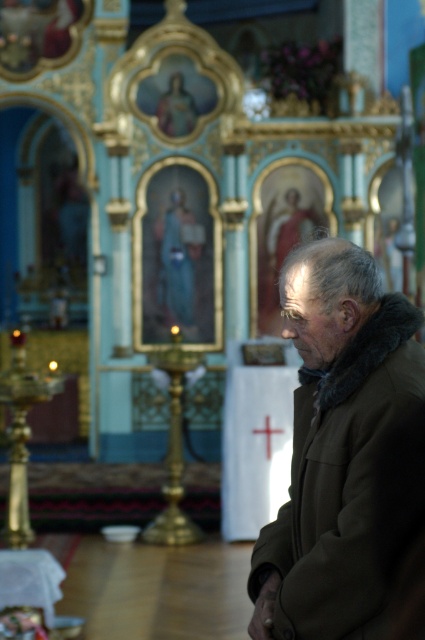
Does point (333, 326) come farther from viewer compared to point (269, 435)?

No, (333, 326) is in front of (269, 435).

Does brown fur-trimmed coat at center have a lesser width compared to white wooden cross at center?

Incorrect, brown fur-trimmed coat at center's width is not less than white wooden cross at center's.

Which is behind, point (320, 390) or point (265, 420)?

Point (265, 420)

At what (x,y) coordinates should I click in order to perform the action: click on brown fur-trimmed coat at center. Please return your answer as a coordinate pair (x, y). Looking at the image, I should click on (x=334, y=444).